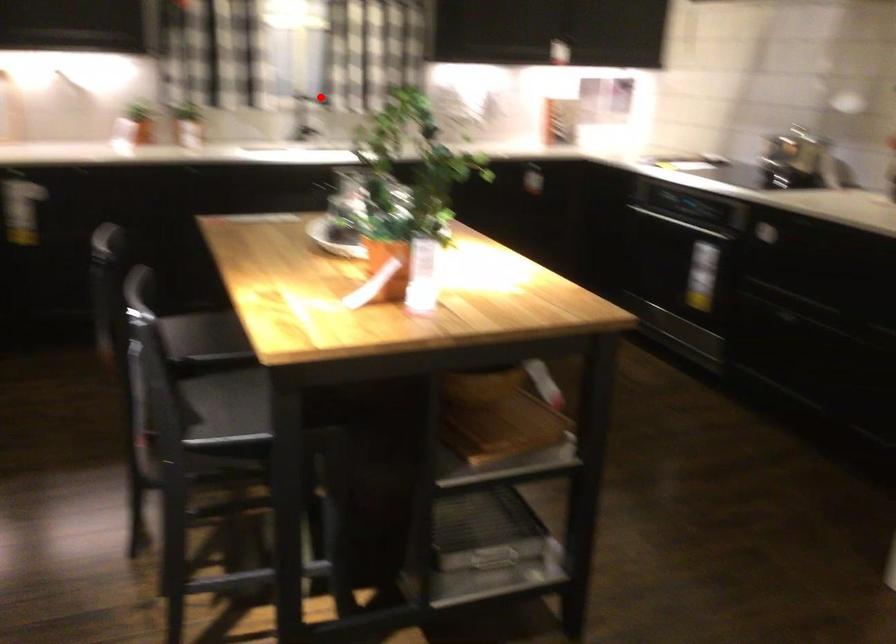
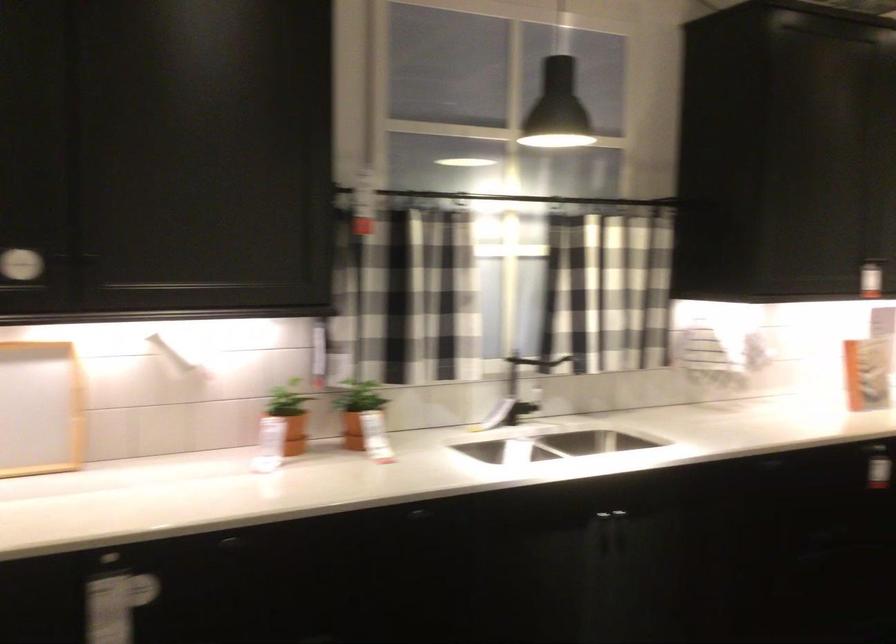
Question: I am providing you with two images of the same scene from different viewpoints. Image1 has a red point marked. In image2, the corresponding 3D location appears at what relative position? Reply with the corresponding letter.

Choices:
 (A) Closer
 (B) Farther

Answer: (A)